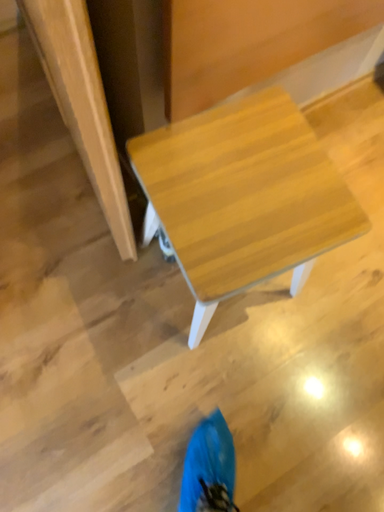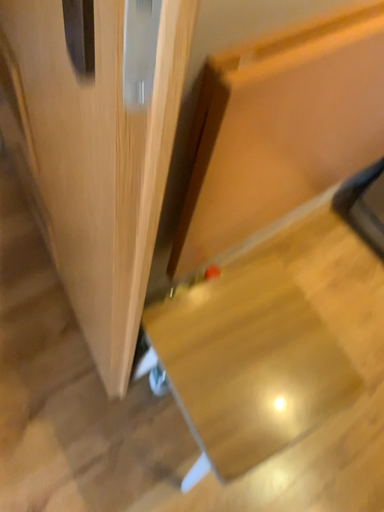
Question: How did the camera likely rotate when shooting the video?

Choices:
 (A) rotated upward
 (B) rotated downward

Answer: (A)